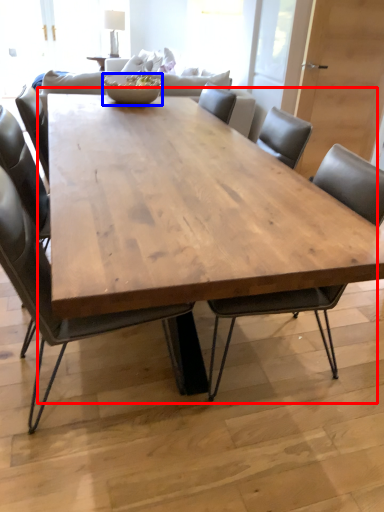
Question: Which of the following is the farthest to the observer, coffee table (highlighted by a red box) or bowl (highlighted by a blue box)?

Choices:
 (A) coffee table
 (B) bowl

Answer: (B)